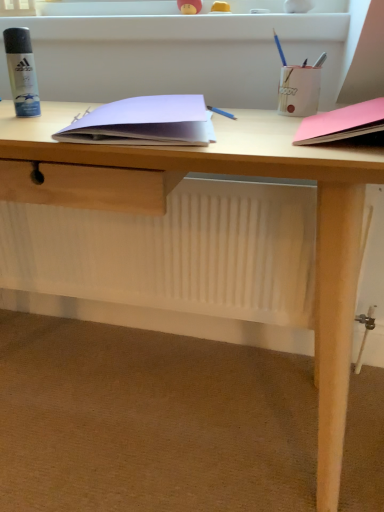
Where is `pink matte paper at right, acting as the 1th paperback book starting from the right`? pink matte paper at right, acting as the 1th paperback book starting from the right is located at coordinates (342, 123).

I want to click on matte black spray can at left, which is counted as the 4th stationery, starting from the right, so click(22, 71).

Describe the element at coordinates (144, 122) in the screenshot. I see `white paper at center, arranged as the first paperback book when viewed from the left` at that location.

What do you see at coordinates (299, 90) in the screenshot? I see `matte white pencil holder at upper right, the 3th stationery from the left` at bounding box center [299, 90].

Identify the location of pink matte paper at right, acting as the 1th paperback book starting from the right. The height and width of the screenshot is (512, 384). (342, 123).

Does metallic silver pen at upper right, which is counted as the first stationery, starting from the right, come in front of matte white pencil holder at upper right, the 2th stationery in the right-to-left sequence?

No, metallic silver pen at upper right, which is counted as the first stationery, starting from the right, is further to the viewer.

Can you confirm if metallic silver pen at upper right, the fourth stationery positioned from the left, is bigger than matte white pencil holder at upper right, the 3th stationery from the left?

No.

Which object is positioned more to the right, metallic silver pen at upper right, the fourth stationery positioned from the left, or matte white pencil holder at upper right, the 3th stationery from the left?

Positioned to the right is metallic silver pen at upper right, the fourth stationery positioned from the left.

Is matte white pencil holder at upper right, the 2th stationery in the right-to-left sequence, at the back of metallic silver pen at upper right, which is counted as the first stationery, starting from the right?

No, metallic silver pen at upper right, which is counted as the first stationery, starting from the right,'s orientation is not away from matte white pencil holder at upper right, the 2th stationery in the right-to-left sequence.

From the image's perspective, is metallic silver pen at upper right, which is counted as the first stationery, starting from the right, under pink matte paper at right, acting as the 1th paperback book starting from the right?

No.

From a real-world perspective, between metallic silver pen at upper right, which is counted as the first stationery, starting from the right, and pink matte paper at right, acting as the 1th paperback book starting from the right, who is vertically higher?

metallic silver pen at upper right, which is counted as the first stationery, starting from the right, from a real-world perspective.

Considering the positions of objects metallic silver pen at upper right, the fourth stationery positioned from the left, and pink matte paper at right, the second paperback book when ordered from left to right, in the image provided, who is in front, metallic silver pen at upper right, the fourth stationery positioned from the left, or pink matte paper at right, the second paperback book when ordered from left to right,?

pink matte paper at right, the second paperback book when ordered from left to right, is closer to the camera.

Is metallic silver pen at upper right, which is counted as the first stationery, starting from the right, positioned with its back to pink matte paper at right, acting as the 1th paperback book starting from the right?

metallic silver pen at upper right, which is counted as the first stationery, starting from the right, is not turned away from pink matte paper at right, acting as the 1th paperback book starting from the right.

Can you confirm if matte black spray can at left, the 1th stationery in the left-to-right sequence, is shorter than pink matte paper at right, acting as the 1th paperback book starting from the right?

Incorrect, the height of matte black spray can at left, the 1th stationery in the left-to-right sequence, does not fall short of that of pink matte paper at right, acting as the 1th paperback book starting from the right.

From a real-world perspective, is matte black spray can at left, which is counted as the 4th stationery, starting from the right, physically located above or below pink matte paper at right, the second paperback book when ordered from left to right?

From a real-world perspective, matte black spray can at left, which is counted as the 4th stationery, starting from the right, is physically above pink matte paper at right, the second paperback book when ordered from left to right.

Would you say matte black spray can at left, which is counted as the 4th stationery, starting from the right, is a long distance from pink matte paper at right, the second paperback book when ordered from left to right?

That's not correct — matte black spray can at left, which is counted as the 4th stationery, starting from the right, is a little close to pink matte paper at right, the second paperback book when ordered from left to right.

Starting from the matte black spray can at left, which is counted as the 4th stationery, starting from the right, which paperback book is the 2nd one to the right? Please provide its 2D coordinates.

[(342, 123)]

Where is `stationery that is the 2nd one when counting downward from the metallic silver pen at upper right, which is counted as the first stationery, starting from the right (from the image's perspective)`? This screenshot has width=384, height=512. stationery that is the 2nd one when counting downward from the metallic silver pen at upper right, which is counted as the first stationery, starting from the right (from the image's perspective) is located at coordinates (299, 90).

In terms of height, does matte white pencil holder at upper right, the 2th stationery in the right-to-left sequence, look taller or shorter compared to metallic silver pen at upper right, which is counted as the first stationery, starting from the right?

matte white pencil holder at upper right, the 2th stationery in the right-to-left sequence, is taller than metallic silver pen at upper right, which is counted as the first stationery, starting from the right.

How different are the orientations of matte white pencil holder at upper right, the 2th stationery in the right-to-left sequence, and metallic silver pen at upper right, the fourth stationery positioned from the left, in degrees?

matte white pencil holder at upper right, the 2th stationery in the right-to-left sequence, and metallic silver pen at upper right, the fourth stationery positioned from the left, are facing 0.00425 degrees away from each other.

Are matte white pencil holder at upper right, the 2th stationery in the right-to-left sequence, and metallic silver pen at upper right, which is counted as the first stationery, starting from the right, far apart?

They are positioned close to each other.

From the image's perspective, which one is positioned higher, blue pencil at upper right, the 2th stationery in the left-to-right sequence, or matte black spray can at left, which is counted as the 4th stationery, starting from the right?

From the image's view, blue pencil at upper right, the 2th stationery in the left-to-right sequence, is above.

From a real-world perspective, is blue pencil at upper right, the 2th stationery in the left-to-right sequence, above or below matte black spray can at left, the 1th stationery in the left-to-right sequence?

blue pencil at upper right, the 2th stationery in the left-to-right sequence, is situated higher than matte black spray can at left, the 1th stationery in the left-to-right sequence, in the real world.

How different are the orientations of blue pencil at upper right, placed as the 3th stationery when sorted from right to left, and matte black spray can at left, which is counted as the 4th stationery, starting from the right, in degrees?

They differ by 3.11 degrees in their facing directions.

Could you tell me if blue pencil at upper right, the 2th stationery in the left-to-right sequence, is turned towards matte black spray can at left, which is counted as the 4th stationery, starting from the right?

No, blue pencil at upper right, the 2th stationery in the left-to-right sequence, does not turn towards matte black spray can at left, which is counted as the 4th stationery, starting from the right.

Is pink matte paper at right, the second paperback book when ordered from left to right, shorter than matte black spray can at left, the 1th stationery in the left-to-right sequence?

Correct, pink matte paper at right, the second paperback book when ordered from left to right, is not as tall as matte black spray can at left, the 1th stationery in the left-to-right sequence.

Based on the photo, from a real-world perspective, which object stands above the other?

In real-world perspective, matte black spray can at left, which is counted as the 4th stationery, starting from the right, is above.

Would you say pink matte paper at right, the second paperback book when ordered from left to right, is a long distance from matte black spray can at left, which is counted as the 4th stationery, starting from the right?

pink matte paper at right, the second paperback book when ordered from left to right, is near matte black spray can at left, which is counted as the 4th stationery, starting from the right, not far away.

Is pink matte paper at right, acting as the 1th paperback book starting from the right, at the right side of matte black spray can at left, the 1th stationery in the left-to-right sequence?

Indeed, pink matte paper at right, acting as the 1th paperback book starting from the right, is positioned on the right side of matte black spray can at left, the 1th stationery in the left-to-right sequence.

Is blue pencil at upper right, placed as the 3th stationery when sorted from right to left, oriented towards white paper at center, arranged as the first paperback book when viewed from the left?

No, blue pencil at upper right, placed as the 3th stationery when sorted from right to left, is not facing towards white paper at center, arranged as the first paperback book when viewed from the left.

In the image, is blue pencil at upper right, placed as the 3th stationery when sorted from right to left, positioned in front of or behind white paper at center, the second paperback book from the right?

In the image, blue pencil at upper right, placed as the 3th stationery when sorted from right to left, appears behind white paper at center, the second paperback book from the right.

Is blue pencil at upper right, the 2th stationery in the left-to-right sequence, to the left of white paper at center, the second paperback book from the right, from the viewer's perspective?

Incorrect, blue pencil at upper right, the 2th stationery in the left-to-right sequence, is not on the left side of white paper at center, the second paperback book from the right.

Which is in front, point (280, 44) or point (113, 119)?

The point (113, 119) is more forward.

There is a metallic silver pen at upper right, the fourth stationery positioned from the left. At what (x,y) coordinates should I click in order to perform the action: click on the 2nd stationery below it (from a real-world perspective). Please return your answer as a coordinate pair (x, y). This screenshot has height=512, width=384. Looking at the image, I should click on (299, 90).

Where is `the 4th stationery behind the pink matte paper at right, the second paperback book when ordered from left to right`? This screenshot has width=384, height=512. the 4th stationery behind the pink matte paper at right, the second paperback book when ordered from left to right is located at coordinates (x=320, y=60).

Consider the image. Based on their spatial positions, is metallic silver pen at upper right, the fourth stationery positioned from the left, or matte black spray can at left, which is counted as the 4th stationery, starting from the right, closer to white paper at center, arranged as the first paperback book when viewed from the left?

Based on the image, matte black spray can at left, which is counted as the 4th stationery, starting from the right, appears to be nearer to white paper at center, arranged as the first paperback book when viewed from the left.

Which object lies further to the anchor point metallic silver pen at upper right, the fourth stationery positioned from the left, matte white pencil holder at upper right, the 3th stationery from the left, or matte black spray can at left, which is counted as the 4th stationery, starting from the right?

Among the two, matte black spray can at left, which is counted as the 4th stationery, starting from the right, is located further to metallic silver pen at upper right, the fourth stationery positioned from the left.

Looking at this image, based on their spatial positions, is matte white pencil holder at upper right, the 3th stationery from the left, or metallic silver pen at upper right, the fourth stationery positioned from the left, further from blue pencil at upper right, the 2th stationery in the left-to-right sequence?

matte white pencil holder at upper right, the 3th stationery from the left, lies further to blue pencil at upper right, the 2th stationery in the left-to-right sequence, than the other object.

When comparing their distances from white paper at center, arranged as the first paperback book when viewed from the left, does matte black spray can at left, which is counted as the 4th stationery, starting from the right, or matte white pencil holder at upper right, the 3th stationery from the left, seem further?

matte white pencil holder at upper right, the 3th stationery from the left, is further to white paper at center, arranged as the first paperback book when viewed from the left.

From the image, which object appears to be farther from blue pencil at upper right, placed as the 3th stationery when sorted from right to left, white paper at center, the second paperback book from the right, or metallic silver pen at upper right, the fourth stationery positioned from the left?

Based on the image, white paper at center, the second paperback book from the right, appears to be further to blue pencil at upper right, placed as the 3th stationery when sorted from right to left.

Looking at the image, which one is located further to blue pencil at upper right, the 2th stationery in the left-to-right sequence, white paper at center, arranged as the first paperback book when viewed from the left, or matte black spray can at left, which is counted as the 4th stationery, starting from the right?

Based on the image, matte black spray can at left, which is counted as the 4th stationery, starting from the right, appears to be further to blue pencil at upper right, the 2th stationery in the left-to-right sequence.

Based on their spatial positions, is pink matte paper at right, acting as the 1th paperback book starting from the right, or blue pencil at upper right, placed as the 3th stationery when sorted from right to left, closer to matte white pencil holder at upper right, the 2th stationery in the right-to-left sequence?

blue pencil at upper right, placed as the 3th stationery when sorted from right to left, lies closer to matte white pencil holder at upper right, the 2th stationery in the right-to-left sequence, than the other object.

Estimate the real-world distances between objects in this image. Which object is further from pink matte paper at right, acting as the 1th paperback book starting from the right, matte white pencil holder at upper right, the 2th stationery in the right-to-left sequence, or blue pencil at upper right, the 2th stationery in the left-to-right sequence?

blue pencil at upper right, the 2th stationery in the left-to-right sequence, is further to pink matte paper at right, acting as the 1th paperback book starting from the right.

This screenshot has width=384, height=512. What are the coordinates of `paperback book situated between matte black spray can at left, the 1th stationery in the left-to-right sequence, and metallic silver pen at upper right, which is counted as the first stationery, starting from the right, from left to right` in the screenshot? It's located at (144, 122).

Locate an element on the screen. The image size is (384, 512). stationery between white paper at center, the second paperback book from the right, and matte white pencil holder at upper right, the 3th stationery from the left, from left to right is located at coordinates (279, 49).

Identify the location of stationery situated between blue pencil at upper right, placed as the 3th stationery when sorted from right to left, and metallic silver pen at upper right, which is counted as the first stationery, starting from the right, from left to right. (299, 90).

The height and width of the screenshot is (512, 384). Identify the location of paperback book between matte black spray can at left, which is counted as the 4th stationery, starting from the right, and blue pencil at upper right, the 2th stationery in the left-to-right sequence, in the horizontal direction. (144, 122).